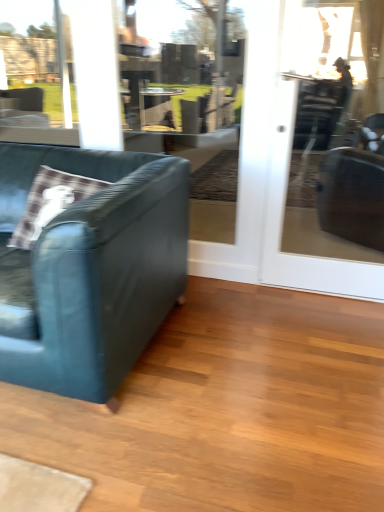
Question: Is velvet teal couch at left thinner than transparent glass screen door at center?

Choices:
 (A) yes
 (B) no

Answer: (B)

Question: Can you confirm if velvet teal couch at left is smaller than transparent glass screen door at center?

Choices:
 (A) no
 (B) yes

Answer: (A)

Question: From a real-world perspective, is velvet teal couch at left on top of transparent glass screen door at center?

Choices:
 (A) yes
 (B) no

Answer: (B)

Question: Is velvet teal couch at left to the right of transparent glass screen door at center from the viewer's perspective?

Choices:
 (A) yes
 (B) no

Answer: (B)

Question: Is velvet teal couch at left in contact with transparent glass screen door at center?

Choices:
 (A) yes
 (B) no

Answer: (B)

Question: Is transparent glass screen door at center inside velvet teal couch at left?

Choices:
 (A) no
 (B) yes

Answer: (A)

Question: From a real-world perspective, is transparent glass screen door at center beneath velvet teal couch at left?

Choices:
 (A) no
 (B) yes

Answer: (A)

Question: Can you confirm if transparent glass screen door at center is thinner than velvet teal couch at left?

Choices:
 (A) yes
 (B) no

Answer: (A)

Question: Is transparent glass screen door at center shorter than velvet teal couch at left?

Choices:
 (A) no
 (B) yes

Answer: (A)

Question: Is transparent glass screen door at center to the right of velvet teal couch at left from the viewer's perspective?

Choices:
 (A) yes
 (B) no

Answer: (A)

Question: Does transparent glass screen door at center have a larger size compared to velvet teal couch at left?

Choices:
 (A) no
 (B) yes

Answer: (A)

Question: Can you confirm if transparent glass screen door at center is wider than velvet teal couch at left?

Choices:
 (A) no
 (B) yes

Answer: (A)

Question: In terms of size, does transparent glass screen door at center appear bigger or smaller than velvet teal couch at left?

Choices:
 (A) small
 (B) big

Answer: (A)